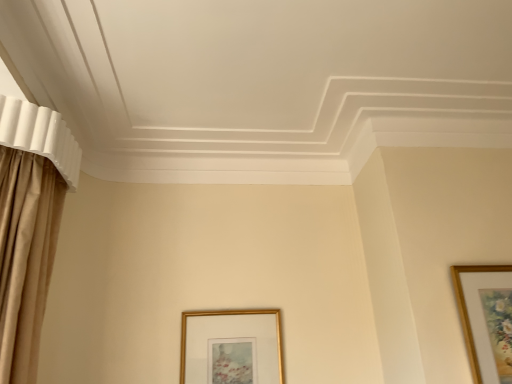
Question: From a real-world perspective, relative to gold metallic picture frame at lower center, which ranks as the 2th picture frame in right-to-left order, is wooden picture frame at upper right, which is counted as the 1th picture frame, starting from the front, vertically above or below?

Choices:
 (A) above
 (B) below

Answer: (A)

Question: Is wooden picture frame at upper right, which is counted as the 1th picture frame, starting from the front, to the left or to the right of gold metallic picture frame at lower center, the first picture frame in the back-to-front sequence, in the image?

Choices:
 (A) left
 (B) right

Answer: (B)

Question: Considering the positions of wooden picture frame at upper right, which ranks as the first picture frame in right-to-left order, and gold metallic picture frame at lower center, placed as the first picture frame when sorted from left to right, in the image, is wooden picture frame at upper right, which ranks as the first picture frame in right-to-left order, taller or shorter than gold metallic picture frame at lower center, placed as the first picture frame when sorted from left to right,?

Choices:
 (A) tall
 (B) short

Answer: (A)

Question: Is gold metallic picture frame at lower center, placed as the first picture frame when sorted from left to right, inside or outside of wooden picture frame at upper right, which is counted as the 1th picture frame, starting from the front?

Choices:
 (A) outside
 (B) inside

Answer: (A)

Question: From their relative heights in the image, would you say gold metallic picture frame at lower center, placed as the first picture frame when sorted from left to right, is taller or shorter than wooden picture frame at upper right, which ranks as the first picture frame in right-to-left order?

Choices:
 (A) tall
 (B) short

Answer: (B)

Question: Considering the relative positions of gold metallic picture frame at lower center, the first picture frame in the back-to-front sequence, and wooden picture frame at upper right, marked as the 2th picture frame in a left-to-right arrangement, in the image provided, is gold metallic picture frame at lower center, the first picture frame in the back-to-front sequence, to the left or to the right of wooden picture frame at upper right, marked as the 2th picture frame in a left-to-right arrangement,?

Choices:
 (A) right
 (B) left

Answer: (B)

Question: Is gold metallic picture frame at lower center, the first picture frame in the back-to-front sequence, wider or thinner than wooden picture frame at upper right, which is counted as the 1th picture frame, starting from the front?

Choices:
 (A) wide
 (B) thin

Answer: (B)